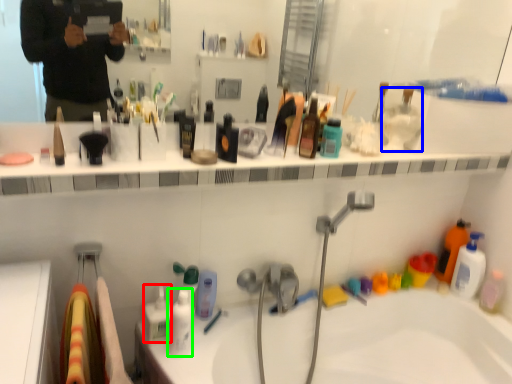
Question: Based on their relative distances, which object is nearer to toiletry (highlighted by a red box)? Choose from toiletry (highlighted by a blue box) and toiletry (highlighted by a green box).

Choices:
 (A) toiletry
 (B) toiletry

Answer: (B)